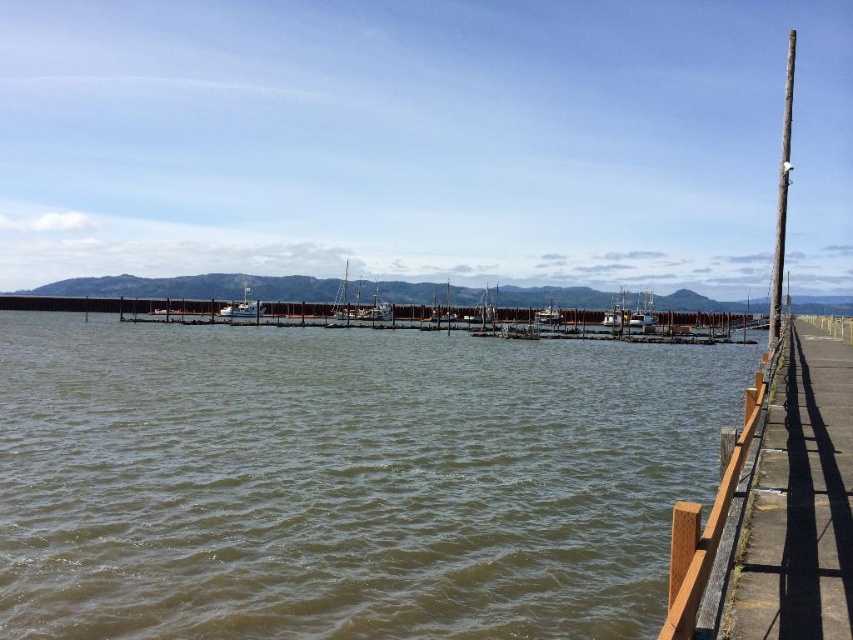
Question: Estimate the real-world distances between objects in this image. Which object is farther from the brown water at center?

Choices:
 (A) brown wooden dock at right
 (B) dark brown wooden pole at right
 (C) white wooden boat at center

Answer: (C)

Question: Considering the relative positions of brown wooden dock at right and white wooden boat at center in the image provided, where is brown wooden dock at right located with respect to white wooden boat at center?

Choices:
 (A) below
 (B) above

Answer: (A)

Question: Can you confirm if brown water at center is positioned to the right of dark brown wooden pole at right?

Choices:
 (A) yes
 (B) no

Answer: (B)

Question: Which of the following is the closest to the observer?

Choices:
 (A) brown wooden dock at right
 (B) dark brown wooden pole at right
 (C) white wooden boat at center
 (D) brown water at center

Answer: (A)

Question: Can you confirm if dark brown wooden pole at right is positioned to the right of white wooden boat at center?

Choices:
 (A) yes
 (B) no

Answer: (A)

Question: Which object is closer to the camera taking this photo?

Choices:
 (A) brown wooden dock at right
 (B) dark brown wooden pole at right
 (C) white wooden boat at center
 (D) brown water at center

Answer: (A)